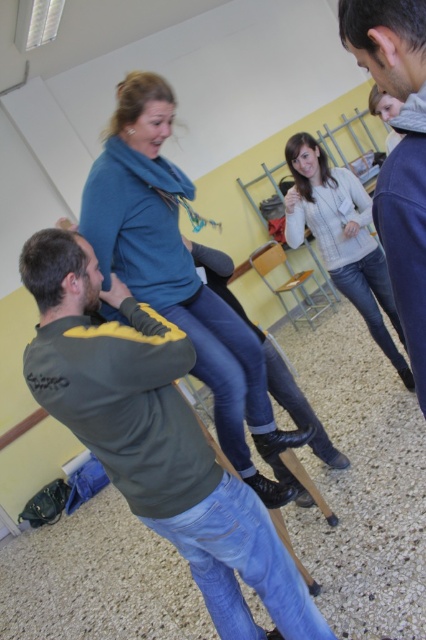
Looking at this image, does light gray knitted sweater at center appear under wooden chair at center?

Indeed, light gray knitted sweater at center is positioned under wooden chair at center.

Can you confirm if light gray knitted sweater at center is taller than wooden chair at center?

Yes.

Is point (337, 260) positioned behind point (273, 259)?

No, (337, 260) is in front of (273, 259).

You are a GUI agent. You are given a task and a screenshot of the screen. Output one action in this format:
    pyautogui.click(x=<x>, y=<y>)
    Task: Click on the light gray knitted sweater at center
    This screenshot has width=426, height=640.
    Given the screenshot: What is the action you would take?
    pyautogui.click(x=342, y=237)

Which of these two, dark green sweatshirt at center or blue soft scarf at upper center, stands shorter?

With less height is dark green sweatshirt at center.

Looking at this image, which of these two, dark green sweatshirt at center or blue soft scarf at upper center, stands taller?

blue soft scarf at upper center

Who is more forward, (48, 404) or (98, 220)?

Point (48, 404) is more forward.

The width and height of the screenshot is (426, 640). What are the coordinates of `dark green sweatshirt at center` in the screenshot? It's located at coord(155,436).

Is point (213, 342) positioned behind point (371, 252)?

No, it is not.

Is point (150, 301) closer to viewer compared to point (354, 205)?

Yes, it is.

Where is `blue soft scarf at upper center`? blue soft scarf at upper center is located at coordinates (178, 273).